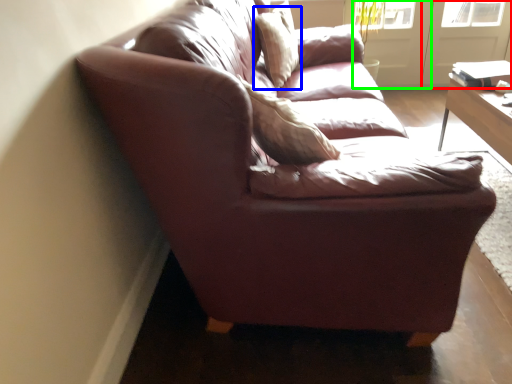
Question: Based on their relative distances, which object is farther from screen door (highlighted by a red box)? Choose from pillow (highlighted by a blue box) and screen door (highlighted by a green box).

Choices:
 (A) pillow
 (B) screen door

Answer: (A)